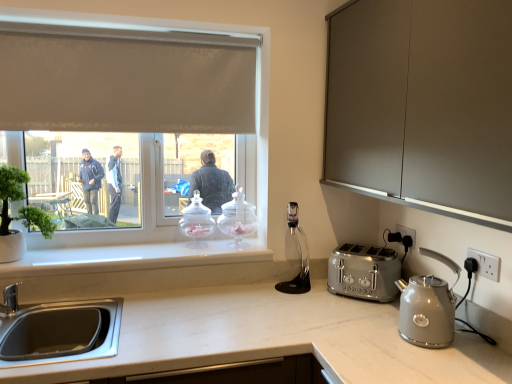
Where is `vacant area that lies between green matte plant at left and clear glass jar at window, placed as the 2th kitchen appliance when sorted from back to front`? The height and width of the screenshot is (384, 512). vacant area that lies between green matte plant at left and clear glass jar at window, placed as the 2th kitchen appliance when sorted from back to front is located at coordinates point(115,254).